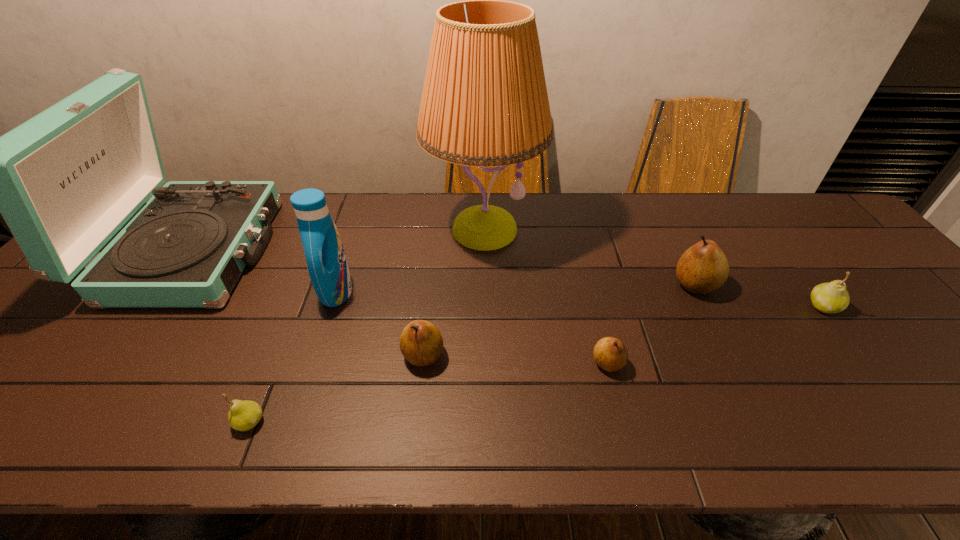
The height and width of the screenshot is (540, 960). In order to click on blank area in the image that satisfies the following two spatial constraints: 1. on the front-facing side of the third tallest object; 2. on the front side of the nearest object in this screenshot , I will do `click(294, 422)`.

Locate an element on the screen. blank area in the image that satisfies the following two spatial constraints: 1. on the back side of the rightmost pear; 2. on the left side of the second pear from left to right is located at coordinates (429, 307).

This screenshot has width=960, height=540. Identify the location of vacant point that satisfies the following two spatial constraints: 1. on the front-facing side of the bigger green pear; 2. on the right side of the sixth object from right to left. (331, 307).